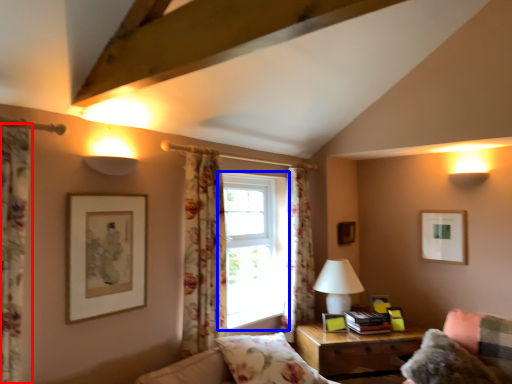
Question: Which point is closer to the camera, curtain (highlighted by a red box) or window (highlighted by a blue box)?

Choices:
 (A) curtain
 (B) window

Answer: (A)